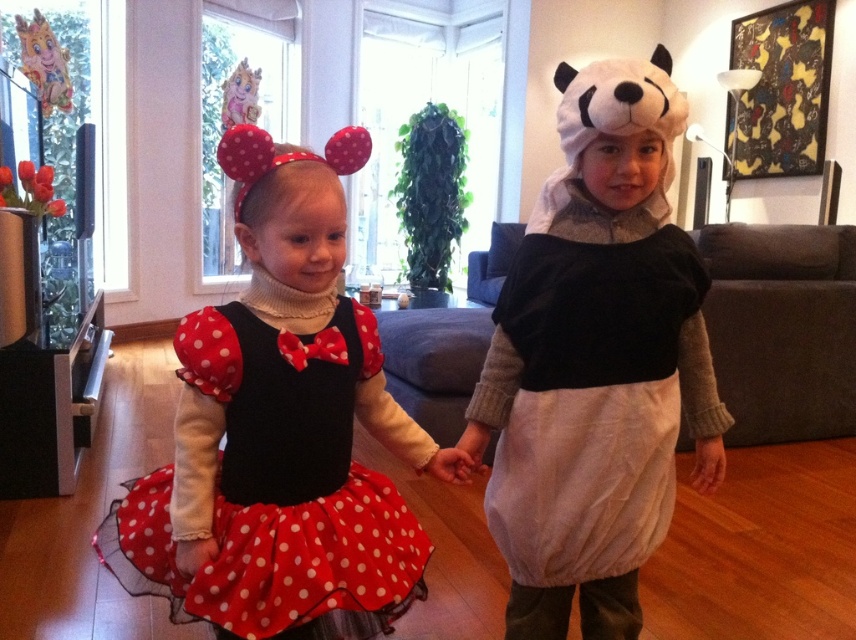
Can you confirm if white cotton dress at center is smaller than paper cutout animal at upper left?

Actually, white cotton dress at center might be larger than paper cutout animal at upper left.

Is white cotton dress at center bigger than paper cutout animal at upper left?

Yes.

At what (x,y) coordinates should I click in order to perform the action: click on white cotton dress at center. Please return your answer as a coordinate pair (x, y). Looking at the image, I should click on (592, 387).

Is matte black dress at center to the right of paper cutout animal at upper left from the viewer's perspective?

Yes, matte black dress at center is to the right of paper cutout animal at upper left.

Who is shorter, matte black dress at center or paper cutout animal at upper left?

paper cutout animal at upper left

Who is more distant from viewer, (705, 276) or (46, 100)?

Positioned behind is point (46, 100).

Where is `matte black dress at center`? matte black dress at center is located at coordinates (280, 432).

Who is positioned more to the right, red polka dot tulle dress at center or pastel pink plush toy at upper left?

red polka dot tulle dress at center

Between red polka dot tulle dress at center and pastel pink plush toy at upper left, which one is positioned higher?

pastel pink plush toy at upper left

What do you see at coordinates (276, 484) in the screenshot?
I see `red polka dot tulle dress at center` at bounding box center [276, 484].

Where is `red polka dot tulle dress at center`? red polka dot tulle dress at center is located at coordinates (276, 484).